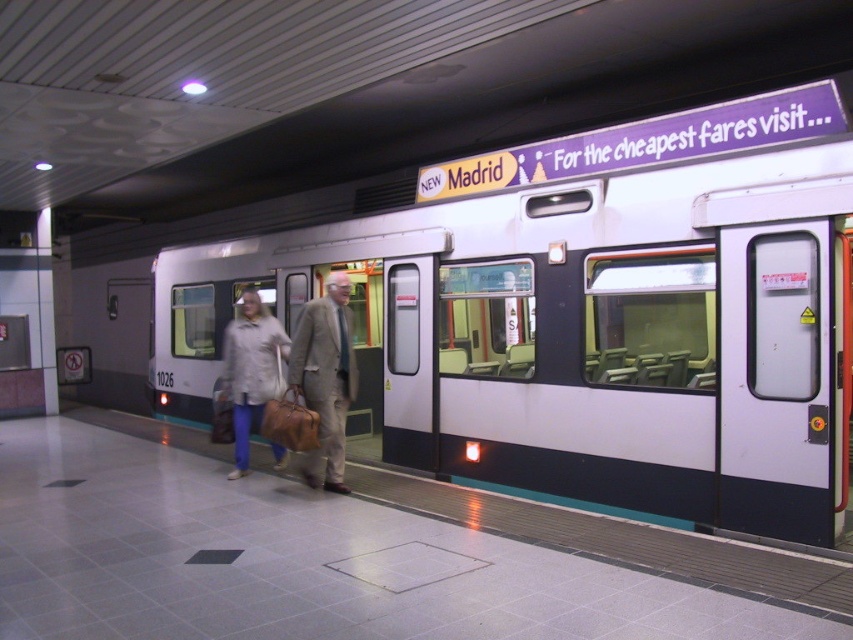
Question: Which object is closer to the camera taking this photo?

Choices:
 (A) white glossy train at center
 (B) light beige fabric suit at center

Answer: (B)

Question: Considering the relative positions of white glossy train at center and light beige coat at center in the image provided, where is white glossy train at center located with respect to light beige coat at center?

Choices:
 (A) left
 (B) right

Answer: (B)

Question: Can you confirm if light beige fabric suit at center is positioned below light beige coat at center?

Choices:
 (A) yes
 (B) no

Answer: (B)

Question: Which object is the farthest from the light beige fabric suit at center?

Choices:
 (A) light beige coat at center
 (B) white glossy train at center

Answer: (B)

Question: Which point is closer to the camera?

Choices:
 (A) (316, 412)
 (B) (242, 444)
 (C) (437, 182)

Answer: (A)

Question: Is white glossy train at center positioned before light beige coat at center?

Choices:
 (A) no
 (B) yes

Answer: (A)